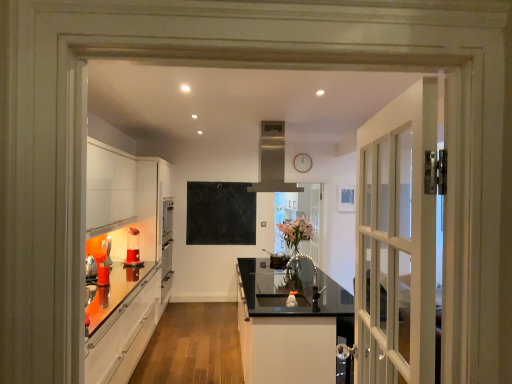
Question: From the image's perspective, is translucent plastic blender at lower left, the second appliance viewed from the right, on clear glass door at center?

Choices:
 (A) no
 (B) yes

Answer: (B)

Question: Would you say translucent plastic blender at lower left, acting as the 3th appliance starting from the front, is outside clear glass door at center?

Choices:
 (A) no
 (B) yes

Answer: (B)

Question: Could you tell me if translucent plastic blender at lower left, acting as the 1th appliance starting from the back, is turned towards clear glass door at center?

Choices:
 (A) no
 (B) yes

Answer: (A)

Question: Is translucent plastic blender at lower left, the 2th appliance viewed from the left, at the right side of clear glass door at center?

Choices:
 (A) no
 (B) yes

Answer: (A)

Question: Is clear glass door at center at the back of translucent plastic blender at lower left, acting as the 3th appliance starting from the front?

Choices:
 (A) yes
 (B) no

Answer: (B)

Question: Does translucent plastic blender at lower left, acting as the 1th appliance starting from the back, have a greater height compared to clear glass door at center?

Choices:
 (A) yes
 (B) no

Answer: (B)

Question: Can translucent plastic blender at lower left, the second appliance viewed from the right, be found inside satin silver exhaust hood at upper center?

Choices:
 (A) no
 (B) yes

Answer: (A)

Question: Does satin silver exhaust hood at upper center have a smaller size compared to translucent plastic blender at lower left, the 2th appliance viewed from the left?

Choices:
 (A) no
 (B) yes

Answer: (A)

Question: From a real-world perspective, is satin silver exhaust hood at upper center on translucent plastic blender at lower left, the second appliance viewed from the right?

Choices:
 (A) no
 (B) yes

Answer: (B)

Question: From the image's perspective, is satin silver exhaust hood at upper center above translucent plastic blender at lower left, the 2th appliance viewed from the left?

Choices:
 (A) yes
 (B) no

Answer: (A)

Question: Can you confirm if satin silver exhaust hood at upper center is bigger than translucent plastic blender at lower left, acting as the 3th appliance starting from the front?

Choices:
 (A) no
 (B) yes

Answer: (B)

Question: Could you tell me if satin silver exhaust hood at upper center is facing translucent plastic blender at lower left, acting as the 3th appliance starting from the front?

Choices:
 (A) yes
 (B) no

Answer: (B)

Question: Is glossy black countertop at center further to the viewer compared to metallic silver faucet at center, the first appliance viewed from the front?

Choices:
 (A) yes
 (B) no

Answer: (B)